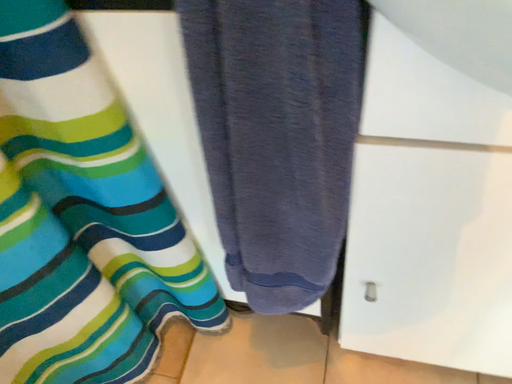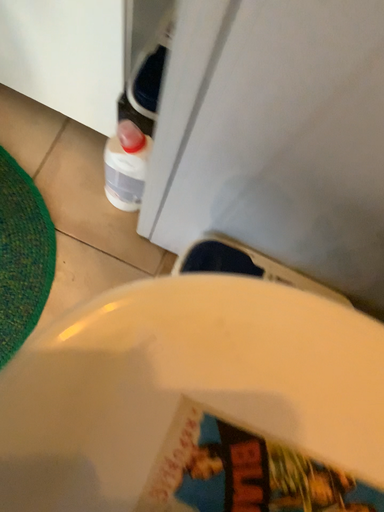
Question: How did the camera likely rotate when shooting the video?

Choices:
 (A) rotated downward
 (B) rotated upward

Answer: (A)